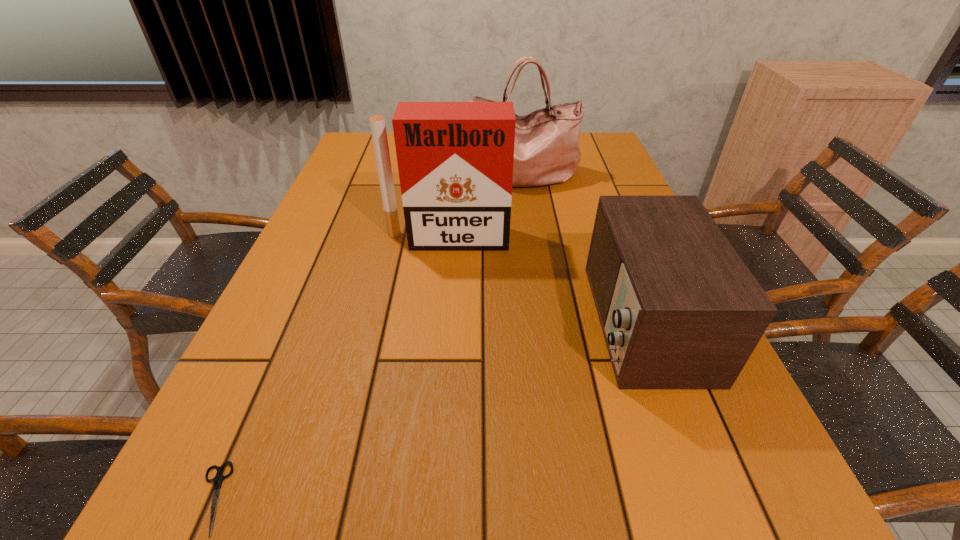
In the image, there is a desktop. Where is `free space at the left edge`? This screenshot has height=540, width=960. free space at the left edge is located at coordinates (285, 401).

Image resolution: width=960 pixels, height=540 pixels. In the image, there is a desktop. Find the location of `vacant space at the right edge`. vacant space at the right edge is located at coordinates (778, 476).

The height and width of the screenshot is (540, 960). I want to click on vacant space at the near right corner, so click(758, 532).

At what (x,y) coordinates should I click in order to perform the action: click on blank region between the radio receiver and the shortest object. Please return your answer as a coordinate pair (x, y). Looking at the image, I should click on (427, 410).

Where is `empty location between the shortest object and the handbag`? The image size is (960, 540). empty location between the shortest object and the handbag is located at coordinates (365, 337).

Locate an element on the screen. The width and height of the screenshot is (960, 540). vacant area that lies between the nearest object and the second farthest object is located at coordinates (329, 368).

Identify the location of free space between the cigarette case and the radio receiver. Image resolution: width=960 pixels, height=540 pixels. (545, 280).

Where is `free space that is in between the second nearest object and the handbag`? free space that is in between the second nearest object and the handbag is located at coordinates (581, 249).

You are a GUI agent. You are given a task and a screenshot of the screen. Output one action in this format:
    pyautogui.click(x=<x>, y=<y>)
    Task: Click on the vacant point located between the shears and the farthest object
    The height and width of the screenshot is (540, 960).
    Given the screenshot: What is the action you would take?
    pyautogui.click(x=365, y=337)

Find the location of a particular element. unoccupied area between the radio receiver and the leftmost object is located at coordinates (427, 410).